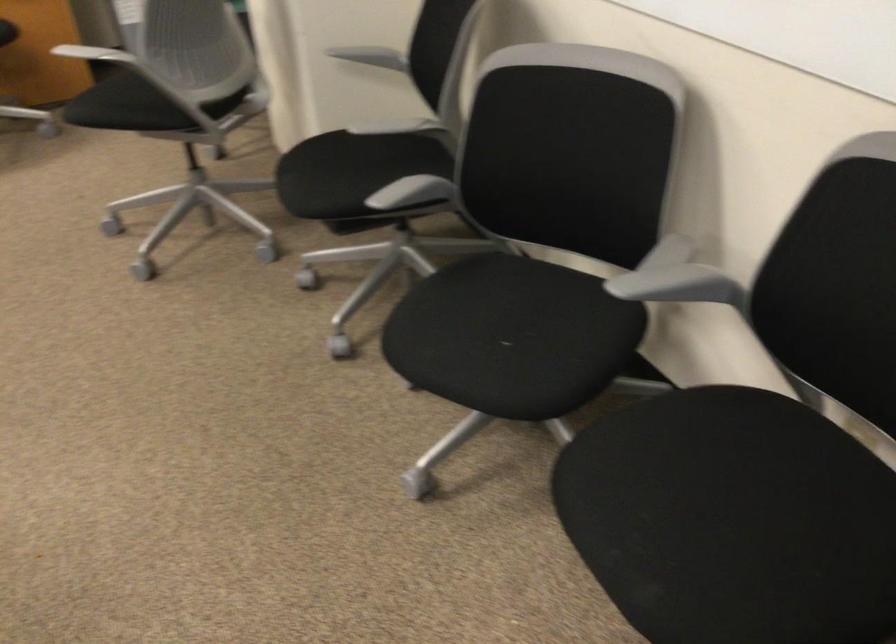
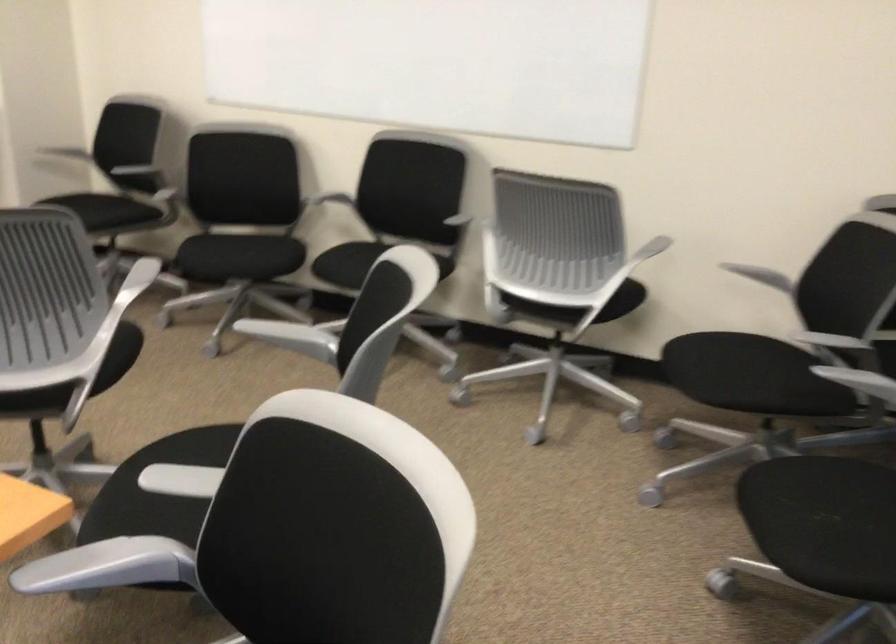
The point at (443, 138) is marked in the first image. Where is the corresponding point in the second image?

(152, 180)